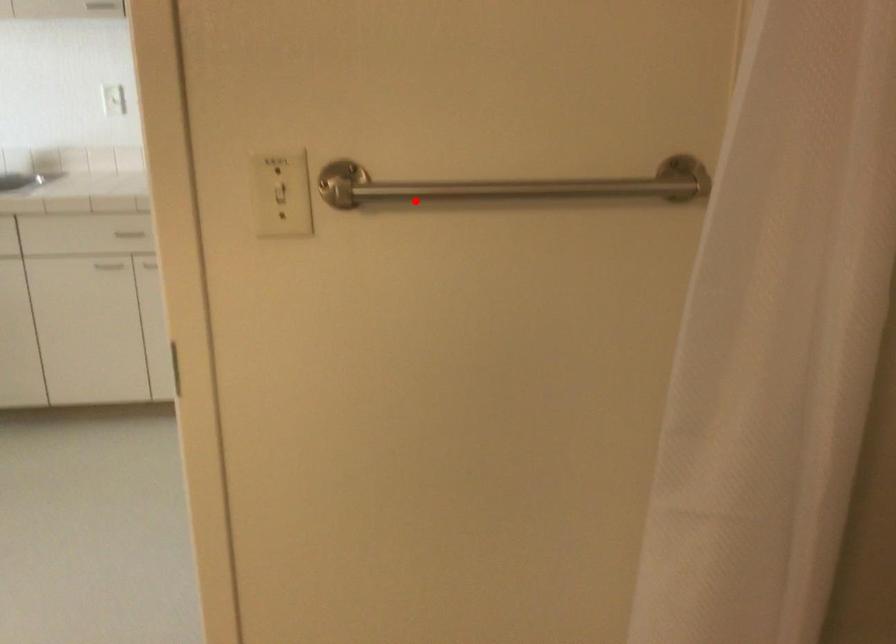
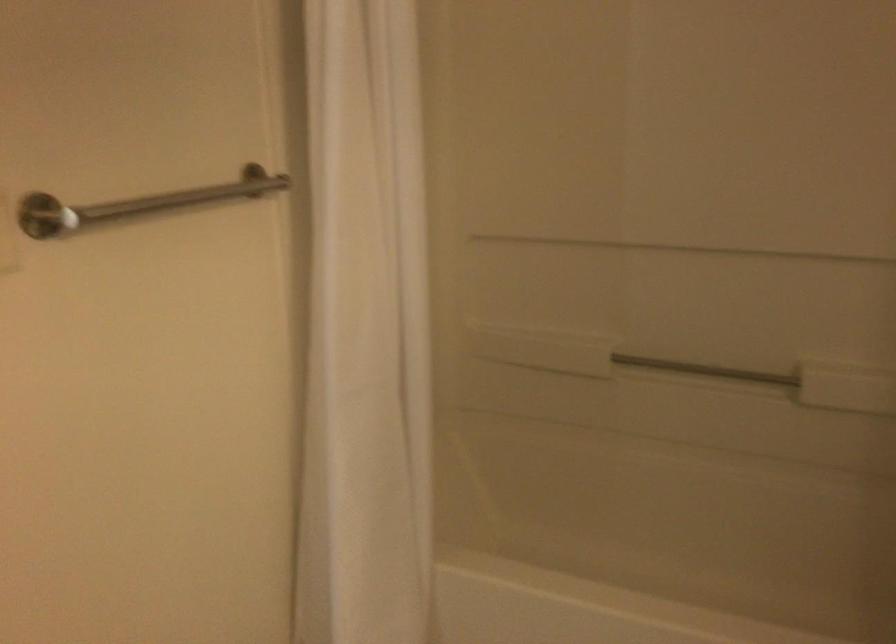
In the second image, find the point that corresponds to the highlighted location in the first image.

(138, 204)